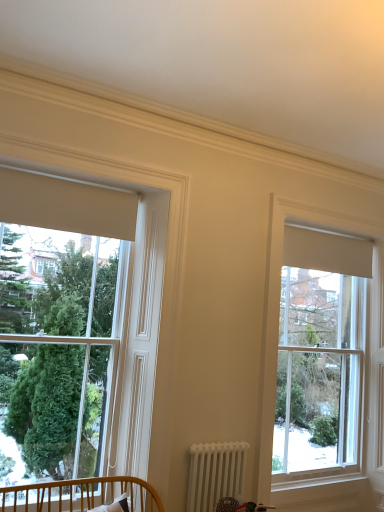
Describe the element at coordinates (77, 333) in the screenshot. Image resolution: width=384 pixels, height=512 pixels. I see `matte white window at left, acting as the 1th window starting from the front` at that location.

This screenshot has width=384, height=512. Identify the location of clear glass window at upper right, the second window viewed from the front. (319, 351).

The width and height of the screenshot is (384, 512). Identify the location of radiator lying in front of the clear glass window at upper right, the second window in the left-to-right sequence. (215, 473).

Considering the positions of objects clear glass window at upper right, which ranks as the first window in right-to-left order, and white metallic radiator at lower center in the image provided, who is more to the left, clear glass window at upper right, which ranks as the first window in right-to-left order, or white metallic radiator at lower center?

white metallic radiator at lower center.

Relative to white metallic radiator at lower center, is clear glass window at upper right, which ranks as the first window in right-to-left order, in front or behind?

In the image, clear glass window at upper right, which ranks as the first window in right-to-left order, appears behind white metallic radiator at lower center.

Is white metallic radiator at lower center at the right side of wooden crib at lower left?

Indeed, white metallic radiator at lower center is positioned on the right side of wooden crib at lower left.

Is white metallic radiator at lower center wider or thinner than wooden crib at lower left?

Considering their sizes, white metallic radiator at lower center looks slimmer than wooden crib at lower left.

Considering the relative sizes of white metallic radiator at lower center and wooden crib at lower left in the image provided, is white metallic radiator at lower center smaller than wooden crib at lower left?

Yes, white metallic radiator at lower center is smaller than wooden crib at lower left.

Is point (196, 460) closer to camera compared to point (365, 240)?

Yes, it is in front of point (365, 240).

Relative to clear glass window at upper right, the second window viewed from the front, is white metallic radiator at lower center in front or behind?

Visually, white metallic radiator at lower center is located in front of clear glass window at upper right, the second window viewed from the front.

Is white metallic radiator at lower center beside clear glass window at upper right, which ranks as the first window in right-to-left order?

white metallic radiator at lower center and clear glass window at upper right, which ranks as the first window in right-to-left order, are not in contact.

Can you tell me how much white metallic radiator at lower center and clear glass window at upper right, the 1th window when ordered from back to front, differ in facing direction?

0.656 degrees.

Is white metallic radiator at lower center to the right of matte white window at left, which is the second window in back-to-front order, from the viewer's perspective?

Yes.

Considering the sizes of white metallic radiator at lower center and matte white window at left, acting as the 1th window starting from the front, in the image, is white metallic radiator at lower center taller or shorter than matte white window at left, acting as the 1th window starting from the front,?

Considering their sizes, white metallic radiator at lower center has less height than matte white window at left, acting as the 1th window starting from the front.

From the picture: Is matte white window at left, which ranks as the 1th window in left-to-right order, at the back of white metallic radiator at lower center?

No, matte white window at left, which ranks as the 1th window in left-to-right order, is not at the back of white metallic radiator at lower center.

Is matte white window at left, positioned as the 2th window in right-to-left order, not within white metallic radiator at lower center?

Indeed, matte white window at left, positioned as the 2th window in right-to-left order, is completely outside white metallic radiator at lower center.

Is matte white window at left, positioned as the 2th window in right-to-left order, behind white metallic radiator at lower center?

No, the depth of matte white window at left, positioned as the 2th window in right-to-left order, is less than that of white metallic radiator at lower center.

Considering the sizes of objects matte white window at left, acting as the 1th window starting from the front, and white metallic radiator at lower center in the image provided, who is smaller, matte white window at left, acting as the 1th window starting from the front, or white metallic radiator at lower center?

With smaller size is white metallic radiator at lower center.

Could you measure the distance between matte white window at left, acting as the 1th window starting from the front, and white metallic radiator at lower center?

matte white window at left, acting as the 1th window starting from the front, is 34.75 inches from white metallic radiator at lower center.

How much distance is there between matte white window at left, acting as the 1th window starting from the front, and wooden crib at lower left?

matte white window at left, acting as the 1th window starting from the front, is 25.78 inches from wooden crib at lower left.

Is matte white window at left, which ranks as the 1th window in left-to-right order, not near wooden crib at lower left?

No, matte white window at left, which ranks as the 1th window in left-to-right order, is in close proximity to wooden crib at lower left.

Is matte white window at left, which ranks as the 1th window in left-to-right order, looking in the opposite direction of wooden crib at lower left?

Yes, matte white window at left, which ranks as the 1th window in left-to-right order,'s orientation is away from wooden crib at lower left.

Does matte white window at left, which ranks as the 1th window in left-to-right order, have a lesser height compared to wooden crib at lower left?

No, matte white window at left, which ranks as the 1th window in left-to-right order, is not shorter than wooden crib at lower left.

Between point (4, 496) and point (191, 486), which one is positioned in front?

The point (4, 496) is in front.

From a real-world perspective, which is physically below, wooden crib at lower left or white metallic radiator at lower center?

wooden crib at lower left, from a real-world perspective.

Is wooden crib at lower left at the right side of white metallic radiator at lower center?

Incorrect, wooden crib at lower left is not on the right side of white metallic radiator at lower center.

Looking at this image, considering the relative sizes of wooden crib at lower left and white metallic radiator at lower center in the image provided, is wooden crib at lower left shorter than white metallic radiator at lower center?

Correct, wooden crib at lower left is not as tall as white metallic radiator at lower center.

Identify the location of radiator below the clear glass window at upper right, which ranks as the first window in right-to-left order (from the image's perspective). Image resolution: width=384 pixels, height=512 pixels. pyautogui.click(x=215, y=473).

Locate an element on the screen. radiator on the right of wooden crib at lower left is located at coordinates (215, 473).

Looking at the image, which one is located further to clear glass window at upper right, which ranks as the first window in right-to-left order, white metallic radiator at lower center or wooden crib at lower left?

wooden crib at lower left.

Which object lies nearer to the anchor point white metallic radiator at lower center, clear glass window at upper right, which ranks as the first window in right-to-left order, or wooden crib at lower left?

wooden crib at lower left.

Looking at the image, which one is located further to white metallic radiator at lower center, wooden crib at lower left or matte white window at left, acting as the 1th window starting from the front?

matte white window at left, acting as the 1th window starting from the front, is positioned further to the anchor white metallic radiator at lower center.

When comparing their distances from wooden crib at lower left, does white metallic radiator at lower center or matte white window at left, acting as the 1th window starting from the front, seem further?

matte white window at left, acting as the 1th window starting from the front.

Based on their spatial positions, is matte white window at left, which ranks as the 1th window in left-to-right order, or wooden crib at lower left further from clear glass window at upper right, the second window viewed from the front?

Based on the image, wooden crib at lower left appears to be further to clear glass window at upper right, the second window viewed from the front.

Considering their positions, is wooden crib at lower left positioned further to clear glass window at upper right, the second window in the left-to-right sequence, than white metallic radiator at lower center?

Among the two, wooden crib at lower left is located further to clear glass window at upper right, the second window in the left-to-right sequence.

Looking at the image, which one is located further to white metallic radiator at lower center, clear glass window at upper right, the second window viewed from the front, or matte white window at left, which ranks as the 1th window in left-to-right order?

clear glass window at upper right, the second window viewed from the front, is further to white metallic radiator at lower center.

Consider the image. From the image, which object appears to be farther from clear glass window at upper right, the second window viewed from the front, matte white window at left, which is the second window in back-to-front order, or white metallic radiator at lower center?

matte white window at left, which is the second window in back-to-front order.

Identify the location of furniture between matte white window at left, which is the second window in back-to-front order, and clear glass window at upper right, the 1th window when ordered from back to front. The image size is (384, 512). (80, 495).

You are a GUI agent. You are given a task and a screenshot of the screen. Output one action in this format:
    pyautogui.click(x=<x>, y=<y>)
    Task: Click on the radiator between wooden crib at lower left and clear glass window at upper right, the second window viewed from the front, from left to right
    This screenshot has width=384, height=512.
    Given the screenshot: What is the action you would take?
    pyautogui.click(x=215, y=473)

Where is `radiator between matte white window at left, positioned as the 2th window in right-to-left order, and clear glass window at upper right, the second window in the left-to-right sequence, from left to right`? This screenshot has width=384, height=512. radiator between matte white window at left, positioned as the 2th window in right-to-left order, and clear glass window at upper right, the second window in the left-to-right sequence, from left to right is located at coordinates (215, 473).

Locate an element on the screen. The image size is (384, 512). furniture between matte white window at left, which ranks as the 1th window in left-to-right order, and white metallic radiator at lower center, in the vertical direction is located at coordinates (80, 495).